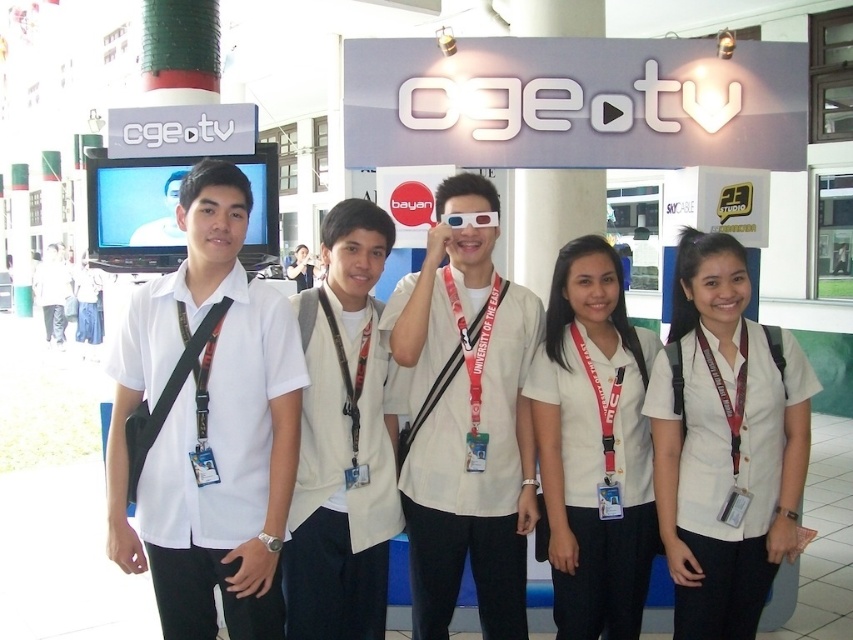
Question: Which point is closer to the camera?

Choices:
 (A) white matte shirt at left
 (B) white matte shirt at center
 (C) white fabric shirt at center
 (D) white matte uniform at center

Answer: (A)

Question: In this image, where is white matte shirt at left located relative to white fabric vest at center?

Choices:
 (A) below
 (B) above

Answer: (B)

Question: Does white fabric shirt at center come in front of white fabric vest at center?

Choices:
 (A) yes
 (B) no

Answer: (B)

Question: Based on their relative distances, which object is nearer to the white matte shirt at left?

Choices:
 (A) white fabric vest at center
 (B) white fabric shirt at center
 (C) white matte shirt at center

Answer: (A)

Question: Can you confirm if white matte uniform at center is bigger than white fabric vest at center?

Choices:
 (A) no
 (B) yes

Answer: (B)

Question: Which object appears farthest from the camera in this image?

Choices:
 (A) white matte shirt at center
 (B) white fabric vest at center
 (C) white matte shirt at left
 (D) white fabric shirt at center

Answer: (A)